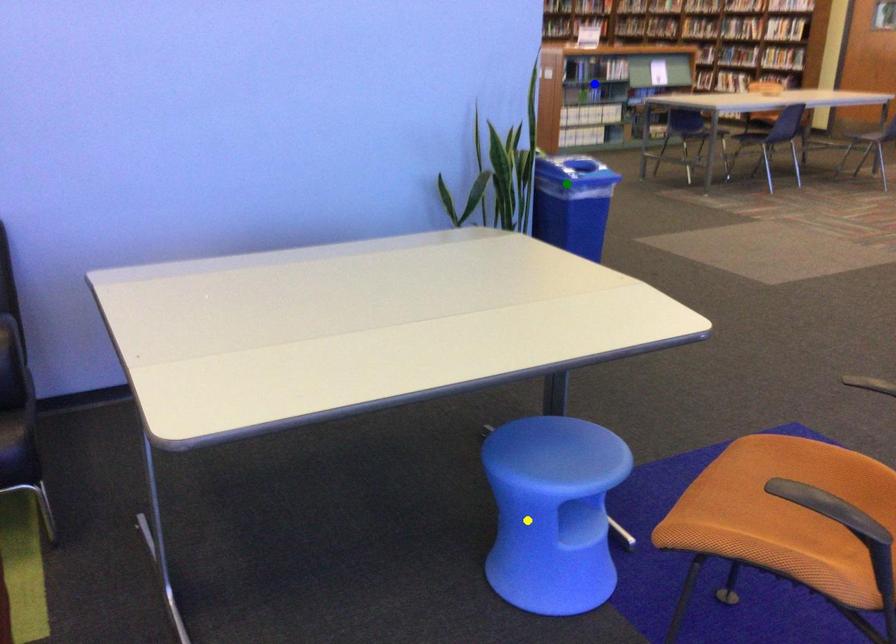
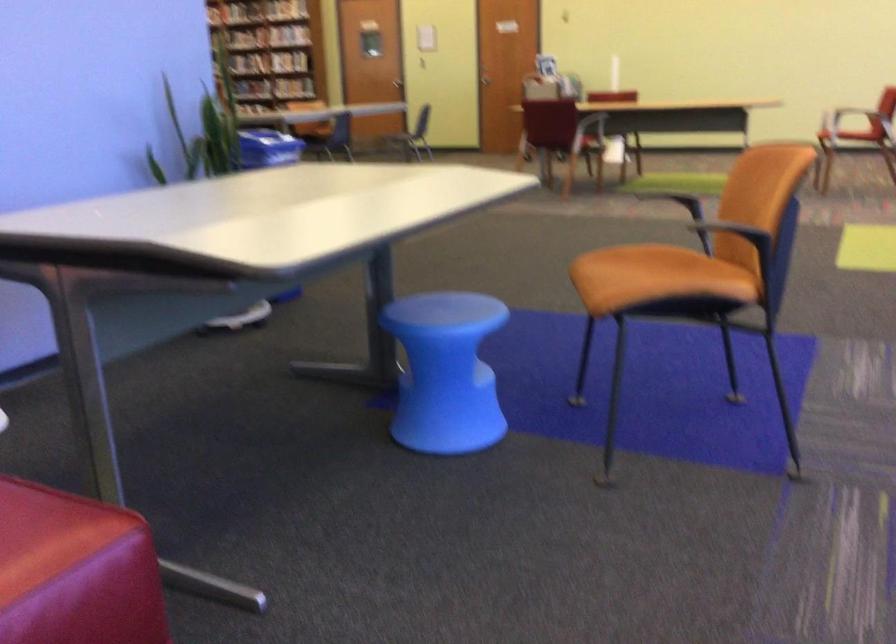
I am providing you with two images of the same scene from different viewpoints. Three points are marked in image1. Which point corresponds to a part or object that is occluded in image2?In image1, three points are marked. Which of them correspond to a part or object that is occluded in image2?Among the three points shown in image1, which one corresponds to a part or object that is no longer visible due to occlusion in image2?

blue point cannot be seen in image2.